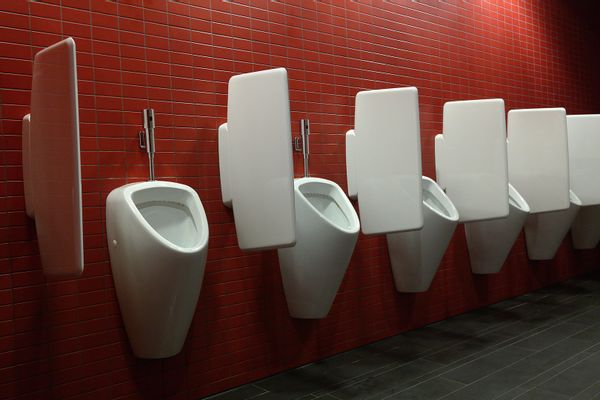
Find the location of a particular element. dividers is located at coordinates (64, 173), (250, 149), (397, 152), (547, 158), (586, 153).